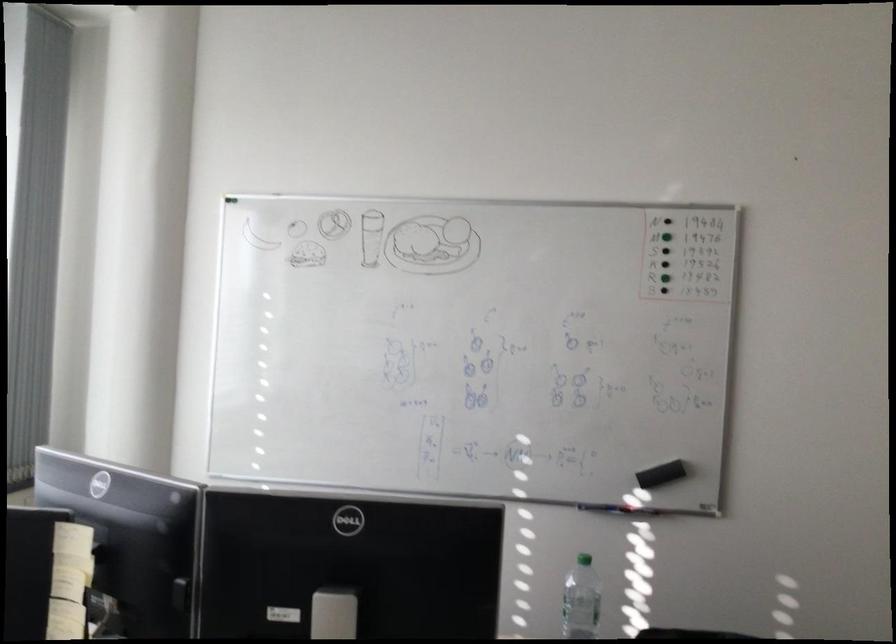
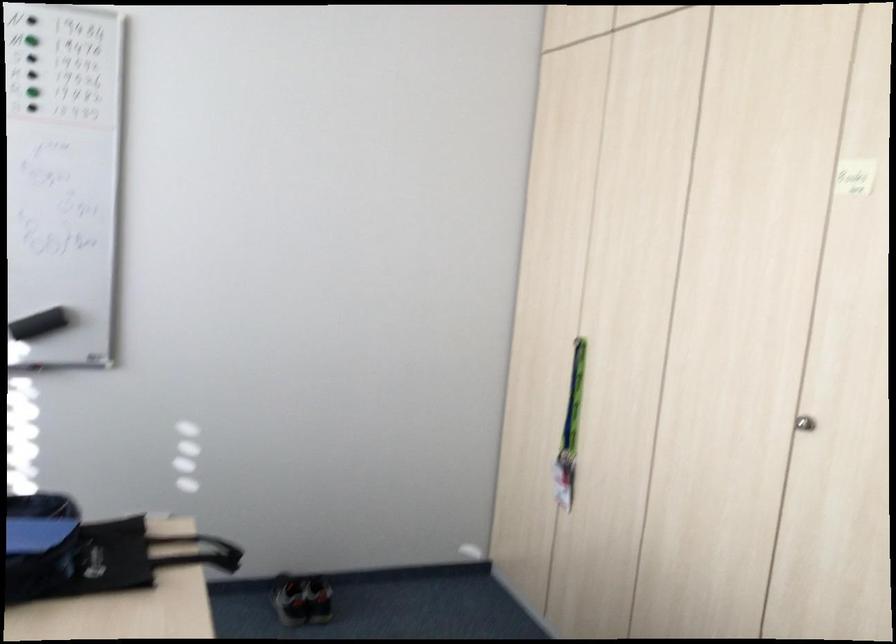
Question: The camera is either moving clockwise (left) or counter-clockwise (right) around the object. The first image is from the beginning of the video and the second image is from the end. Is the camera moving left or right when shooting the video?

Choices:
 (A) Left
 (B) Right

Answer: (A)